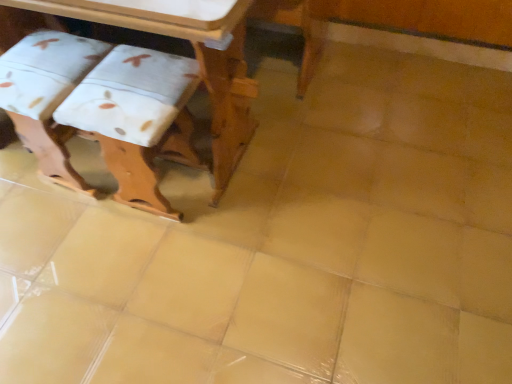
Where is `blank area to the left of white fabric step stool at lower left, arranged as the 2th step stool when viewed from the right`? This screenshot has height=384, width=512. blank area to the left of white fabric step stool at lower left, arranged as the 2th step stool when viewed from the right is located at coordinates (17, 176).